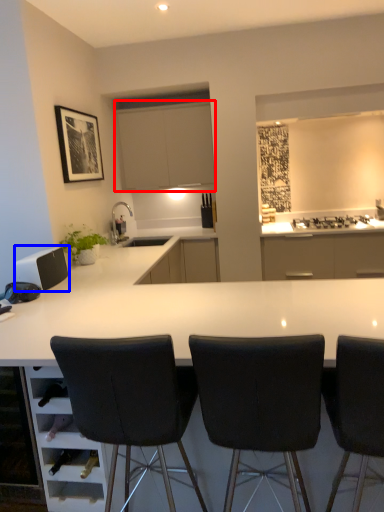
Question: Which object is further to the camera taking this photo, cabinetry (highlighted by a red box) or appliance (highlighted by a blue box)?

Choices:
 (A) cabinetry
 (B) appliance

Answer: (A)